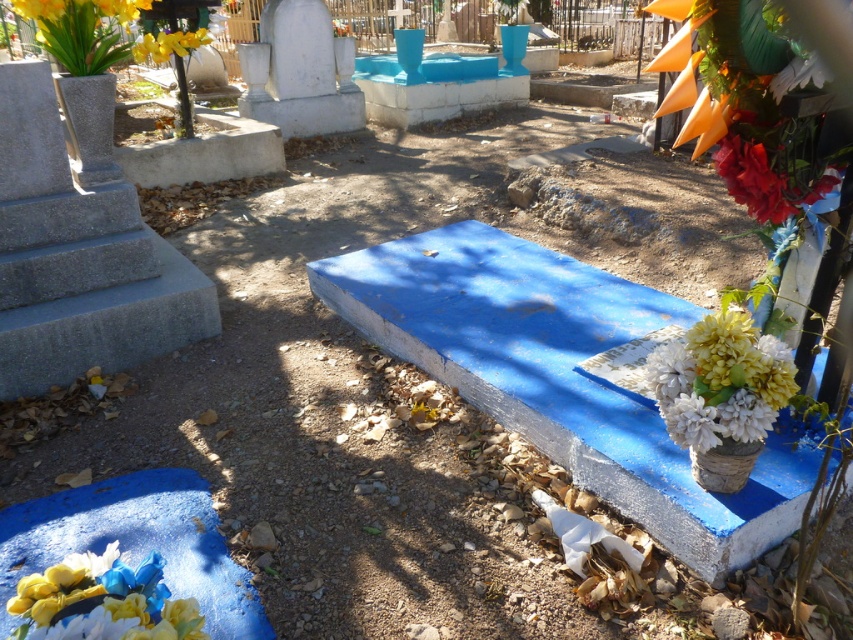
Question: In this image, where is white matte flowers at center right located relative to matte floral bouquet at lower left?

Choices:
 (A) right
 (B) left

Answer: (A)

Question: Estimate the real-world distances between objects in this image. Which object is closer to the white matte flowers at center right?

Choices:
 (A) yellow matte flowers at upper left
 (B) red matte flower at upper right

Answer: (B)

Question: In this image, where is white matte flowers at center right located relative to matte floral bouquet at lower left?

Choices:
 (A) below
 (B) above

Answer: (B)

Question: From the image, what is the correct spatial relationship of white matte flowers at center right in relation to matte floral bouquet at lower left?

Choices:
 (A) above
 (B) below

Answer: (A)

Question: Which object is closer to the camera taking this photo?

Choices:
 (A) yellow matte flowers at upper left
 (B) red matte flower at upper right

Answer: (B)

Question: Among these objects, which one is farthest from the camera?

Choices:
 (A) red matte flower at upper right
 (B) white matte flowers at center right
 (C) matte floral bouquet at lower left
 (D) yellow matte flowers at upper left

Answer: (D)